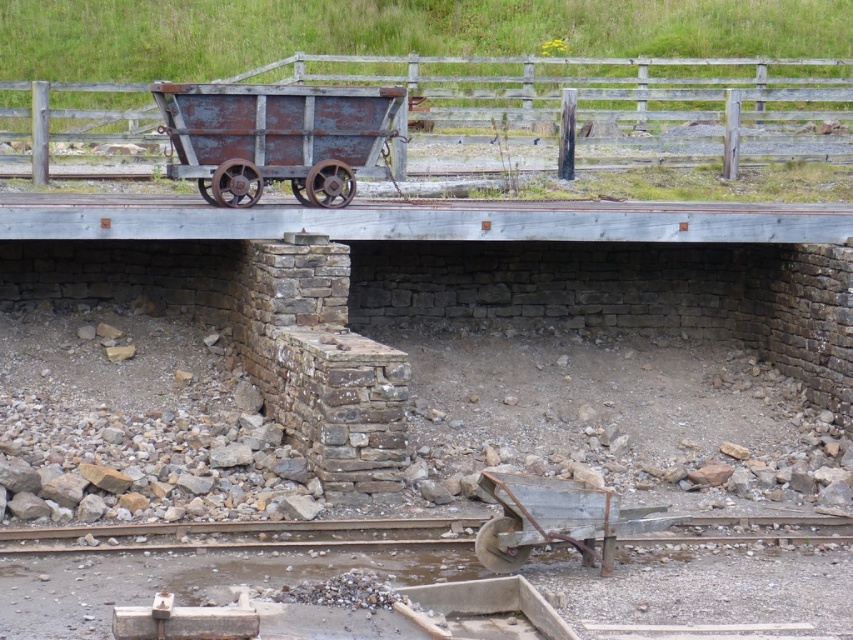
Who is positioned more to the left, rusty metal cart at center or rusty metal wagon at lower center?

Positioned to the left is rusty metal cart at center.

Is rusty metal cart at center to the right of rusty metal wagon at lower center from the viewer's perspective?

In fact, rusty metal cart at center is to the left of rusty metal wagon at lower center.

Between point (236, 186) and point (543, 499), which one is positioned in front?

Point (543, 499) is in front.

Locate an element on the screen. rusty metal cart at center is located at coordinates (276, 138).